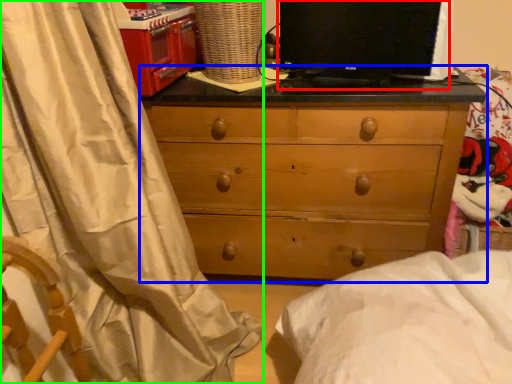
Question: Considering the real-world distances, which object is closest to computer monitor (highlighted by a red box)? chest of drawers (highlighted by a blue box) or curtain (highlighted by a green box).

Choices:
 (A) chest of drawers
 (B) curtain

Answer: (A)